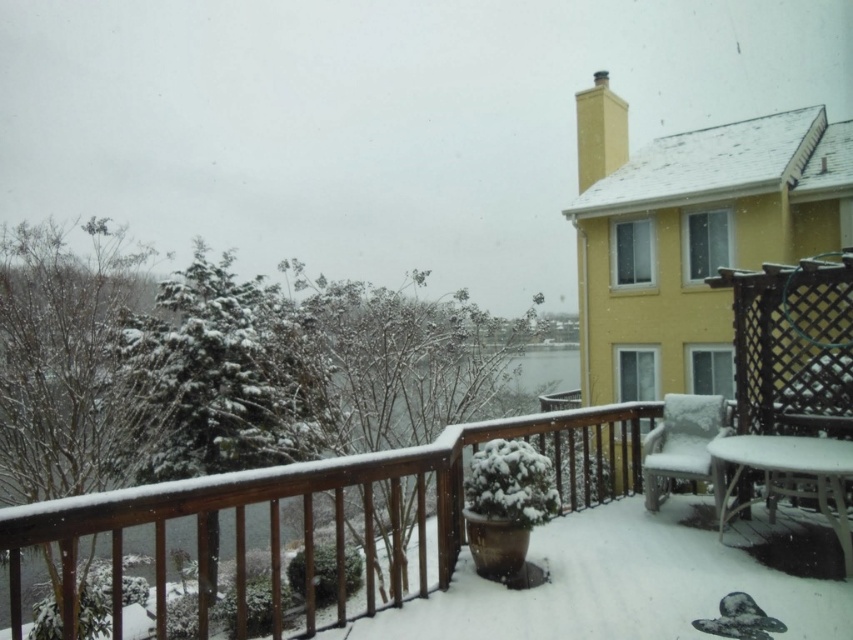
Question: Which is nearer to the white fluffy chair at lower right?

Choices:
 (A) snow-covered wooden porch at center
 (B) white glossy table at lower right

Answer: (B)

Question: Which point appears closest to the camera in this image?

Choices:
 (A) (749, 500)
 (B) (86, 499)
 (C) (664, 428)

Answer: (B)

Question: Can you confirm if snow-covered wooden porch at center is positioned below white fluffy chair at lower right?

Choices:
 (A) yes
 (B) no

Answer: (A)

Question: Is snow-covered wooden porch at center below white glossy table at lower right?

Choices:
 (A) no
 (B) yes

Answer: (B)

Question: Can you confirm if white glossy table at lower right is wider than white fluffy chair at lower right?

Choices:
 (A) yes
 (B) no

Answer: (A)

Question: Among these objects, which one is nearest to the camera?

Choices:
 (A) snow-covered wooden porch at center
 (B) white glossy table at lower right
 (C) white fluffy chair at lower right

Answer: (A)